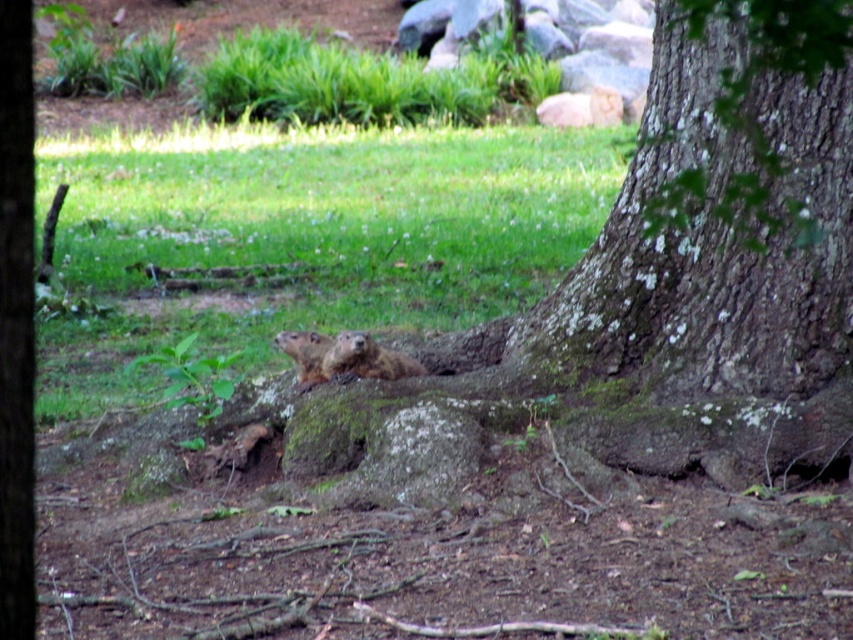
Question: Which object appears closest to the camera in this image?

Choices:
 (A) brown rough bark at center
 (B) brown furry ground squirrel at center

Answer: (A)

Question: Estimate the real-world distances between objects in this image. Which object is closer to the brown rough bark at center?

Choices:
 (A) brown furry ground squirrel at center
 (B) brown furry groundhog at center

Answer: (A)

Question: Is brown furry ground squirrel at center further to the viewer compared to brown furry groundhog at center?

Choices:
 (A) no
 (B) yes

Answer: (A)

Question: Can you confirm if brown rough bark at center is bigger than brown furry ground squirrel at center?

Choices:
 (A) no
 (B) yes

Answer: (A)

Question: Which of these objects is positioned farthest from the brown furry groundhog at center?

Choices:
 (A) brown rough bark at center
 (B) brown furry ground squirrel at center

Answer: (A)

Question: Does brown rough bark at center lie behind brown furry groundhog at center?

Choices:
 (A) yes
 (B) no

Answer: (B)